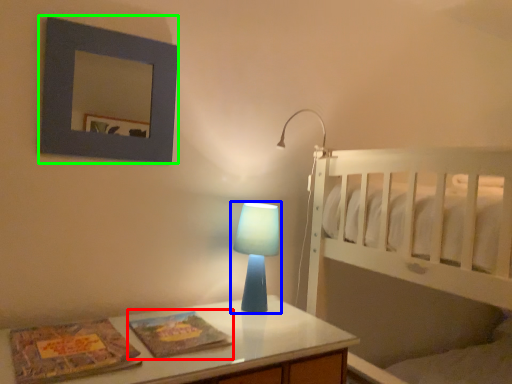
Question: Which object is positioned closest to magazine (highlighted by a red box)? Select from lamp (highlighted by a blue box) and picture frame (highlighted by a green box).

Choices:
 (A) lamp
 (B) picture frame

Answer: (A)